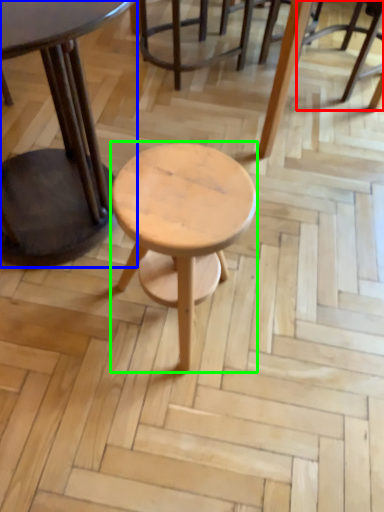
Question: Considering the real-world distances, which object is closest to chair (highlighted by a red box)? table (highlighted by a blue box) or stool (highlighted by a green box).

Choices:
 (A) table
 (B) stool

Answer: (A)